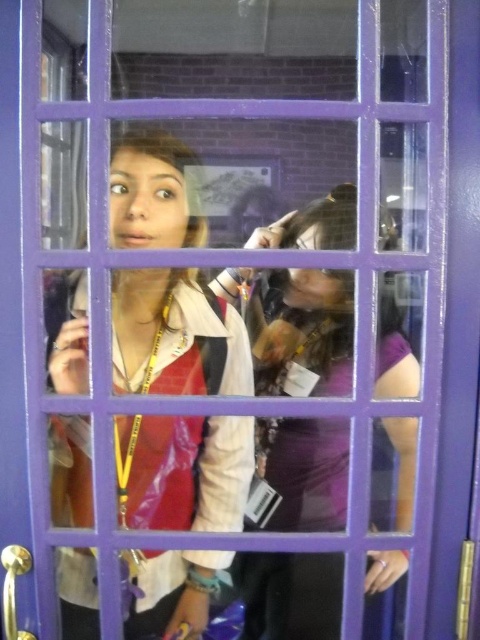
Question: Observing the image, what is the correct spatial positioning of matte white shirt at center in reference to purple matte dress at center?

Choices:
 (A) above
 (B) below

Answer: (A)

Question: Does matte white shirt at center have a lesser width compared to purple matte dress at center?

Choices:
 (A) no
 (B) yes

Answer: (B)

Question: Which object appears farthest from the camera in this image?

Choices:
 (A) purple matte dress at center
 (B) matte white shirt at center

Answer: (B)

Question: Can you confirm if matte white shirt at center is smaller than purple matte dress at center?

Choices:
 (A) yes
 (B) no

Answer: (A)

Question: Which point is farther from the camera taking this photo?

Choices:
 (A) (168, 154)
 (B) (300, 508)

Answer: (B)